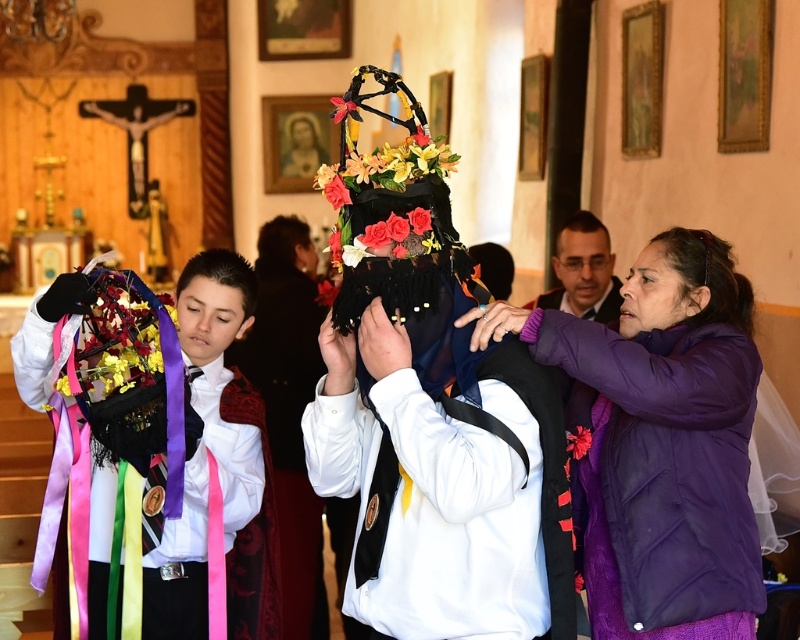
How far apart are purple puffy jacket at right and black velvet headdress at center?

A distance of 26.04 feet exists between purple puffy jacket at right and black velvet headdress at center.

Can you confirm if purple puffy jacket at right is thinner than black velvet headdress at center?

No.

Locate an element on the screen. The height and width of the screenshot is (640, 800). purple puffy jacket at right is located at coordinates (666, 339).

Find the location of `purple puffy jacket at right`. purple puffy jacket at right is located at coordinates (666, 339).

Does purple soft jacket at center have a larger size compared to dark brown hair at center?

Incorrect, purple soft jacket at center is not larger than dark brown hair at center.

Is point (696, 300) more distant than point (288, 221)?

No, it is not.

Locate an element on the screen. This screenshot has height=640, width=800. purple soft jacket at center is located at coordinates tap(684, 284).

The height and width of the screenshot is (640, 800). I want to click on purple soft jacket at center, so click(x=684, y=284).

Looking at this image, does purple fleece jacket at right have a larger size compared to matte black hair at left?

Yes.

Can you confirm if purple fleece jacket at right is positioned above matte black hair at left?

No, purple fleece jacket at right is not above matte black hair at left.

Which is in front, point (736, 561) or point (224, 268)?

Point (736, 561)

I want to click on purple fleece jacket at right, so click(x=660, y=442).